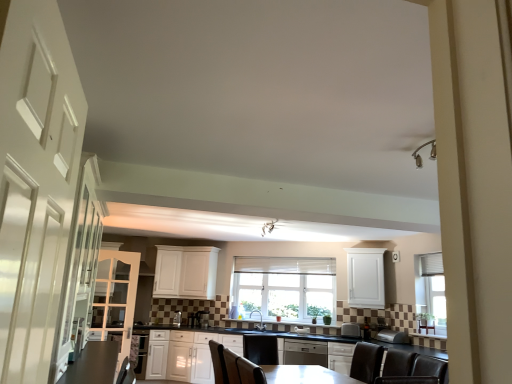
Question: Looking at the image, does satin black dishwasher at center seem bigger or smaller compared to white textured window at center?

Choices:
 (A) big
 (B) small

Answer: (A)

Question: Is satin black dishwasher at center to the left or to the right of white textured window at center in the image?

Choices:
 (A) left
 (B) right

Answer: (B)

Question: Which object is the farthest from the satin silver toaster at lower center, the 1th appliance positioned from the right?

Choices:
 (A) metallic silver swivel chair at lower center
 (B) white glossy cabinet at center, marked as the 4th cabinetry in a left-to-right arrangement
 (C) metallic silver light fixture at upper center
 (D) white glossy door at left
 (E) satin silver toaster at lower center, the 2th appliance viewed from the front

Answer: (D)

Question: Which object is positioned farthest from the white matte cabinet at upper right, acting as the first cabinetry starting from the right?

Choices:
 (A) satin silver toaster at lower center, the 3th appliance positioned from the left
 (B) metallic silver swivel chair at lower center
 (C) white matte cabinet at center, acting as the second cabinetry starting from the left
 (D) white glossy cabinet at center, which appears as the 2th cabinetry when viewed from the right
 (E) white glossy cabinet at left, the 1th cabinetry when ordered from left to right

Answer: (E)